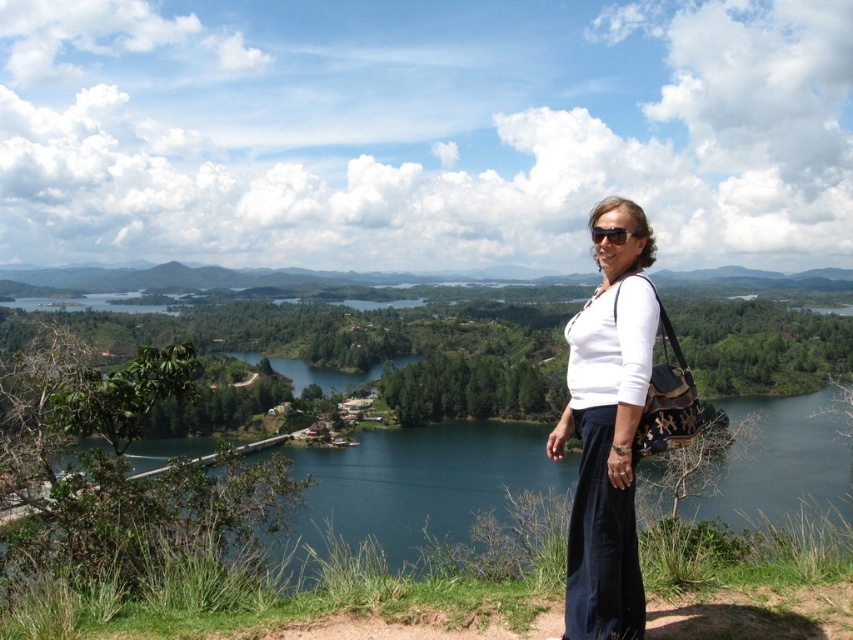
Is point (749, 442) farther from camera compared to point (570, 392)?

Yes, it is behind point (570, 392).

Does blue water at center have a smaller size compared to white matte shirt at center?

No.

Locate an element on the screen. The height and width of the screenshot is (640, 853). blue water at center is located at coordinates (422, 481).

Which is in front, point (316, 497) or point (605, 236)?

Point (605, 236)

Can you confirm if blue water at center is positioned below matte black sunglasses at center?

Yes, blue water at center is below matte black sunglasses at center.

Does point (474, 509) lie in front of point (633, 234)?

No, it is behind (633, 234).

Where is `blue water at center`? blue water at center is located at coordinates (422, 481).

Where is `white matte shirt at center`? white matte shirt at center is located at coordinates (607, 432).

Is the position of white matte shirt at center more distant than that of matte black sunglasses at center?

No, it is not.

Which is behind, point (577, 374) or point (631, 230)?

The point (631, 230) is more distant.

Where is `white matte shirt at center`? The image size is (853, 640). white matte shirt at center is located at coordinates (607, 432).